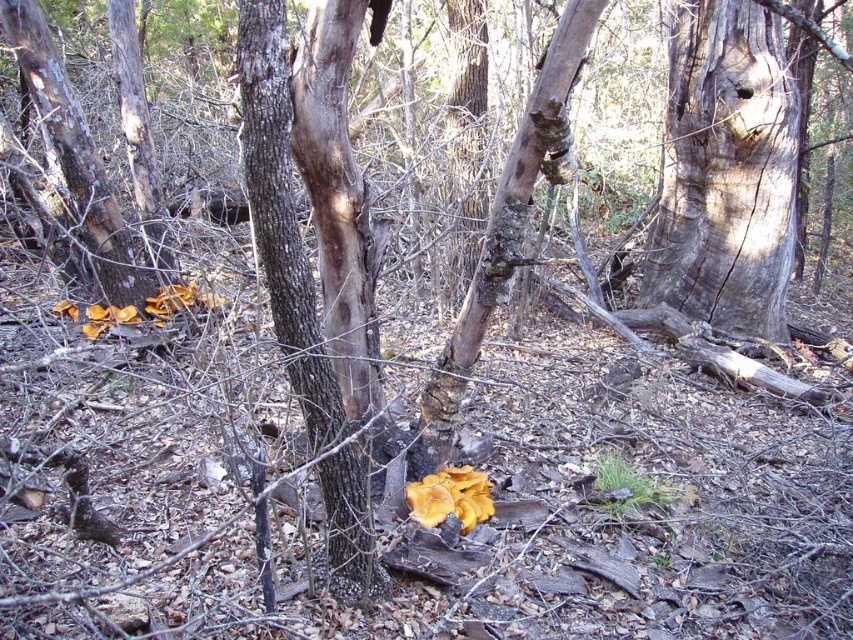
You are a hiker who has stumbled upon this forest scene. You notice a point marked at coordinates (282, 216). What natural feature does this point indicate?

The point at coordinates (282, 216) marks the brown rough bark at center.

You are a hiker trying to identify the tree in the center of the forest scene. You notice two types of bark textures on the tree trunk. Which part of the tree trunk is closer to you, the smooth gray bark at center or the brown rough bark at center?

The smooth gray bark at center is closer to you because the brown rough bark at center is behind it.